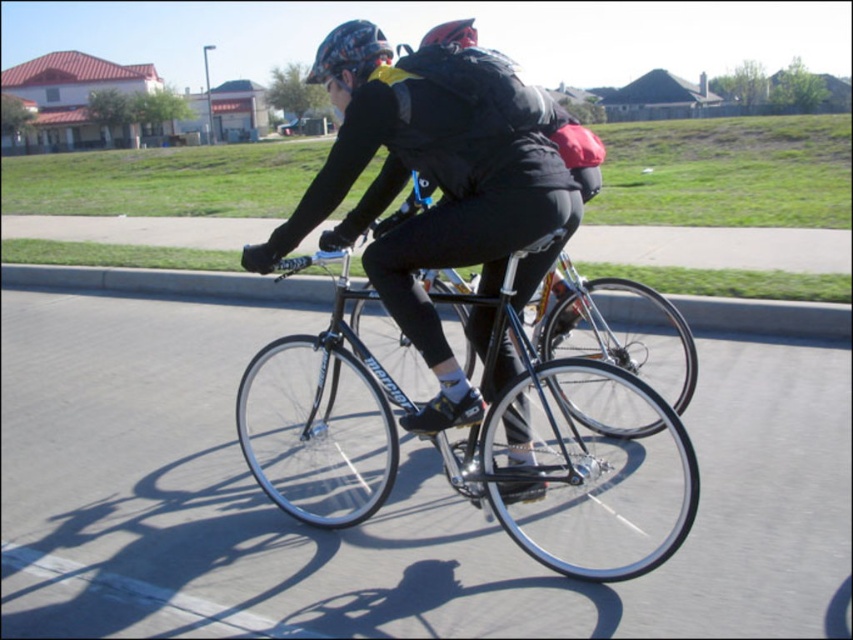
How far apart are matte black bicycle at center and shiny black bicycle at center?

matte black bicycle at center and shiny black bicycle at center are 19.41 inches apart from each other.

The width and height of the screenshot is (853, 640). What are the coordinates of `matte black bicycle at center` in the screenshot? It's located at (442, 195).

Does point (474, 308) come behind point (421, 38)?

That is False.

Who is more distant from viewer, (445,204) or (450,38)?

Point (450,38)

Find the location of a particular element. This screenshot has height=640, width=853. matte black bicycle at center is located at coordinates (442, 195).

Is shiny black bicycle at center taller than shiny red helmet at upper center?

Incorrect, shiny black bicycle at center's height is not larger of shiny red helmet at upper center's.

Who is higher up, shiny black bicycle at center or shiny red helmet at upper center?

shiny red helmet at upper center

Is point (692, 451) closer to camera compared to point (447, 28)?

Yes, point (692, 451) is in front of point (447, 28).

Locate an element on the screen. This screenshot has height=640, width=853. shiny black bicycle at center is located at coordinates (556, 438).